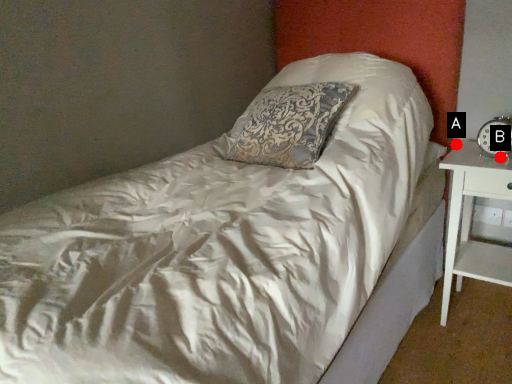
Question: Two points are circled on the image, labeled by A and B beside each circle. Among these points, which one is nearest to the camera?

Choices:
 (A) A is closer
 (B) B is closer

Answer: (B)